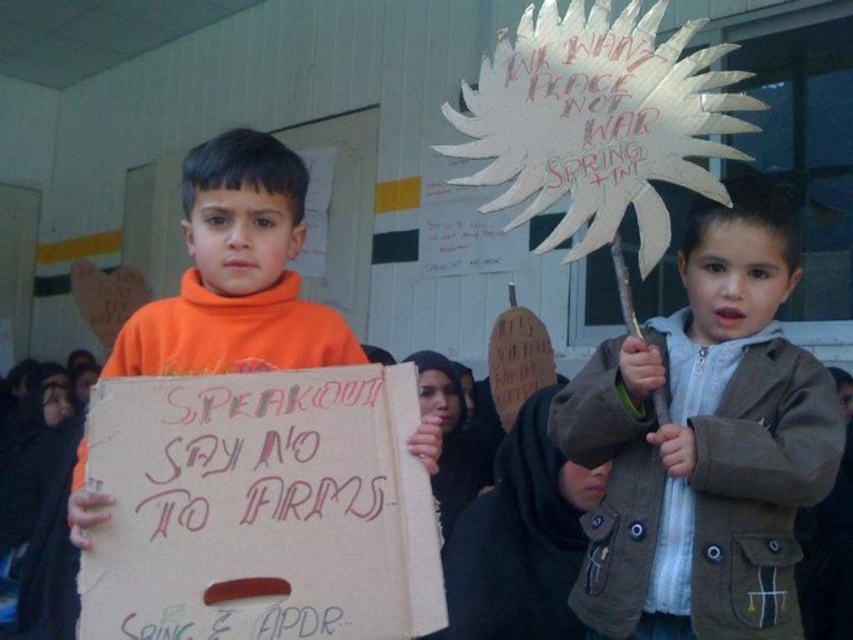
Which is behind, point (653, 547) or point (221, 240)?

Point (221, 240)

At what (x,y) coordinates should I click in order to perform the action: click on brown cotton jacket at center. Please return your answer as a coordinate pair (x, y). Looking at the image, I should click on (705, 440).

The height and width of the screenshot is (640, 853). Find the location of `brown cotton jacket at center`. brown cotton jacket at center is located at coordinates (705, 440).